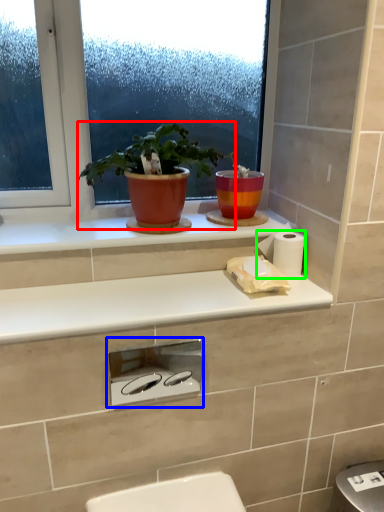
Question: Which object is positioned closest to houseplant (highlighted by a red box)? Select from appliance (highlighted by a blue box) and toilet paper (highlighted by a green box).

Choices:
 (A) appliance
 (B) toilet paper

Answer: (B)